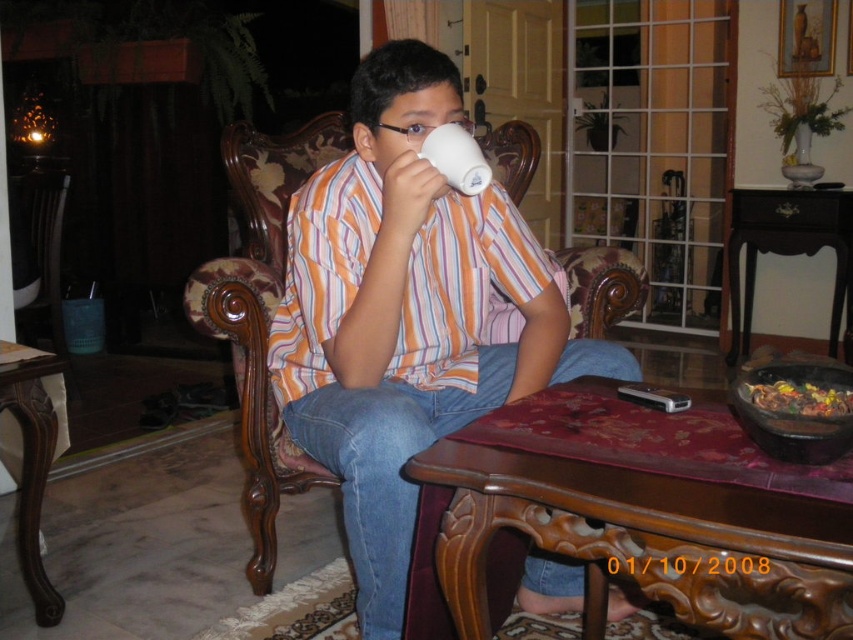
Question: Is brown wood table at lower center above black wood table at center?

Choices:
 (A) yes
 (B) no

Answer: (B)

Question: Is matte striped shirt at center smaller than shiny metallic bowl at lower right?

Choices:
 (A) yes
 (B) no

Answer: (B)

Question: Can you confirm if matte striped shirt at center is positioned to the left of brown wood table at lower center?

Choices:
 (A) no
 (B) yes

Answer: (B)

Question: Which point is farther to the camera?

Choices:
 (A) (x=45, y=452)
 (B) (x=463, y=355)
 (C) (x=778, y=408)

Answer: (B)

Question: Which of these objects is positioned closest to the matte striped shirt at center?

Choices:
 (A) shiny metallic bowl at lower right
 (B) brown wood table at lower center

Answer: (B)

Question: Estimate the real-world distances between objects in this image. Which object is closer to the brown polished wood table at lower left?

Choices:
 (A) black wood table at center
 (B) matte striped shirt at center
 (C) brown wood table at lower center

Answer: (B)